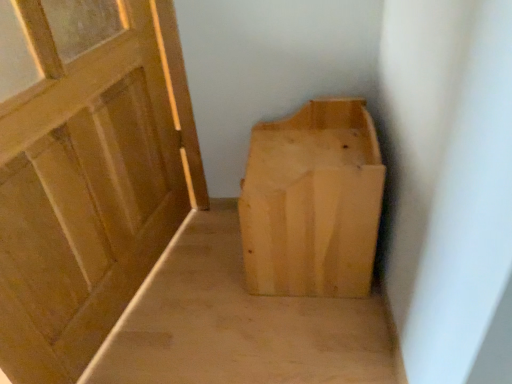
Question: Is matte wood door at left in front of or behind light wood bench at center in the image?

Choices:
 (A) behind
 (B) front

Answer: (B)

Question: Based on their sizes in the image, would you say matte wood door at left is bigger or smaller than light wood bench at center?

Choices:
 (A) small
 (B) big

Answer: (B)

Question: Estimate the real-world distances between objects in this image. Which object is closer to the light wood bench at center?

Choices:
 (A) light wood/rough textured box at center
 (B) matte wood door at left

Answer: (A)

Question: Estimate the real-world distances between objects in this image. Which object is farther from the light wood/rough textured box at center?

Choices:
 (A) matte wood door at left
 (B) light wood bench at center

Answer: (A)